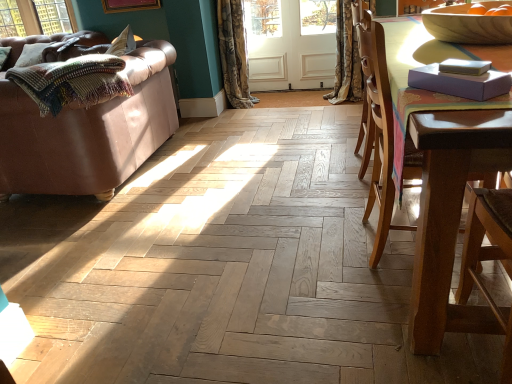
Question: Is leather couch at left wider than textured floral curtain at center, placed as the second curtain when sorted from right to left?

Choices:
 (A) no
 (B) yes

Answer: (B)

Question: Is leather couch at left shorter than textured floral curtain at center, arranged as the 1th curtain when viewed from the left?

Choices:
 (A) yes
 (B) no

Answer: (A)

Question: Is leather couch at left outside textured floral curtain at center, placed as the second curtain when sorted from right to left?

Choices:
 (A) yes
 (B) no

Answer: (A)

Question: Considering the relative positions of leather couch at left and textured floral curtain at center, arranged as the 1th curtain when viewed from the left, in the image provided, is leather couch at left to the left of textured floral curtain at center, arranged as the 1th curtain when viewed from the left, from the viewer's perspective?

Choices:
 (A) yes
 (B) no

Answer: (A)

Question: From the image's perspective, is leather couch at left on top of textured floral curtain at center, arranged as the 1th curtain when viewed from the left?

Choices:
 (A) yes
 (B) no

Answer: (B)

Question: Does leather couch at left have a greater height compared to textured floral curtain at center, arranged as the 1th curtain when viewed from the left?

Choices:
 (A) no
 (B) yes

Answer: (A)

Question: Could you tell me if white wood screen door at center is turned towards textured floral curtain at center, arranged as the 1th curtain when viewed from the left?

Choices:
 (A) no
 (B) yes

Answer: (B)

Question: Is white wood screen door at center taller than textured floral curtain at center, arranged as the 1th curtain when viewed from the left?

Choices:
 (A) no
 (B) yes

Answer: (A)

Question: From the image's perspective, is white wood screen door at center located above textured floral curtain at center, placed as the second curtain when sorted from right to left?

Choices:
 (A) yes
 (B) no

Answer: (A)

Question: Can you confirm if white wood screen door at center is wider than textured floral curtain at center, arranged as the 1th curtain when viewed from the left?

Choices:
 (A) no
 (B) yes

Answer: (A)

Question: Considering the relative positions of white wood screen door at center and textured floral curtain at center, placed as the second curtain when sorted from right to left, in the image provided, is white wood screen door at center in front of textured floral curtain at center, placed as the second curtain when sorted from right to left,?

Choices:
 (A) yes
 (B) no

Answer: (B)

Question: Is white wood screen door at center with textured floral curtain at center, placed as the second curtain when sorted from right to left?

Choices:
 (A) yes
 (B) no

Answer: (B)

Question: Can you confirm if purple matte book at upper right is positioned to the right of textured floral curtain at center, arranged as the 1th curtain when viewed from the left?

Choices:
 (A) no
 (B) yes

Answer: (B)